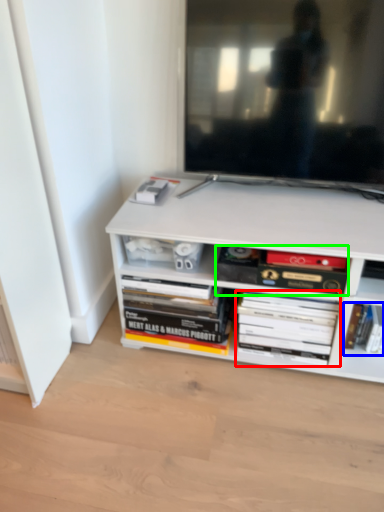
Question: Considering the real-world distances, which object is closest to book (highlighted by a red box)? book (highlighted by a blue box) or book (highlighted by a green box).

Choices:
 (A) book
 (B) book

Answer: (B)